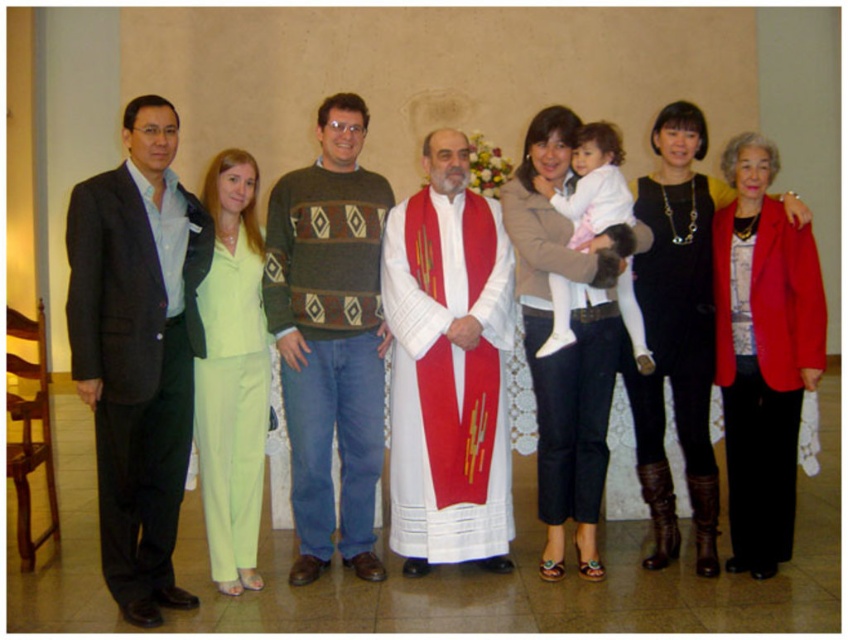
Question: Which object is the farthest from the knit sweater at center?

Choices:
 (A) matte beige jacket at center
 (B) white silk robe at center
 (C) dark gray suit at left
 (D) black leather boots at right

Answer: (D)

Question: Is dark gray suit at left to the left of linen green pants at center from the viewer's perspective?

Choices:
 (A) yes
 (B) no

Answer: (A)

Question: Among these points, which one is farthest from the camera?

Choices:
 (A) (646, 312)
 (B) (305, 198)
 (C) (261, 374)
 (D) (770, 458)

Answer: (B)

Question: Considering the real-world distances, which object is closest to the white silk robe at center?

Choices:
 (A) knit sweater at center
 (B) matte beige jacket at center
 (C) linen green pants at center

Answer: (A)

Question: Is matte beige jacket at center to the left of matte red robe at right from the viewer's perspective?

Choices:
 (A) no
 (B) yes

Answer: (B)

Question: Is matte beige jacket at center further to the viewer compared to linen green pants at center?

Choices:
 (A) yes
 (B) no

Answer: (A)